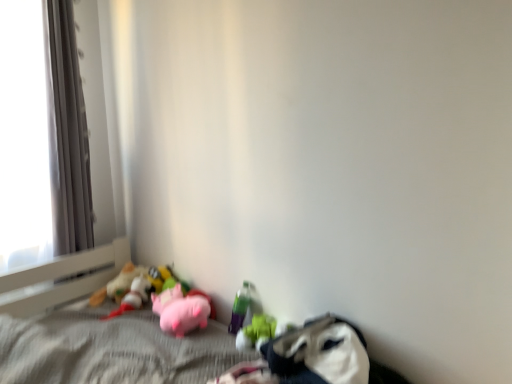
What is the approximate height of pink plush toys at lower left?

pink plush toys at lower left is 26.25 inches in height.

What is the approximate height of rubber duck at lower center, arranged as the 4th toy when viewed from the left?

rubber duck at lower center, arranged as the 4th toy when viewed from the left, is 4.71 inches tall.

What do you see at coordinates (260, 332) in the screenshot? I see `rubber duck at lower center, which ranks as the first toy in right-to-left order` at bounding box center [260, 332].

Image resolution: width=512 pixels, height=384 pixels. What do you see at coordinates (244, 306) in the screenshot? I see `translucent plastic bottle at lower center, placed as the second toy when sorted from right to left` at bounding box center [244, 306].

Describe the element at coordinates (165, 279) in the screenshot. The width and height of the screenshot is (512, 384). I see `pink plush pig at lower center, the third toy when ordered from right to left` at that location.

Identify the location of pink plush pig at center. (155, 295).

Where is `pink plush toys at lower left`? The height and width of the screenshot is (384, 512). pink plush toys at lower left is located at coordinates (110, 349).

Does translucent plastic bottle at lower center, positioned as the third toy in left-to-right order, have a smaller size compared to pink plush toys at lower left?

Yes, translucent plastic bottle at lower center, positioned as the third toy in left-to-right order, is smaller than pink plush toys at lower left.

Considering their positions, is translucent plastic bottle at lower center, positioned as the third toy in left-to-right order, located in front of or behind pink plush toys at lower left?

translucent plastic bottle at lower center, positioned as the third toy in left-to-right order, is positioned farther from the viewer than pink plush toys at lower left.

Identify the location of bed that is on the left side of translucent plastic bottle at lower center, placed as the second toy when sorted from right to left. (110, 349).

Is translucent plastic bottle at lower center, positioned as the third toy in left-to-right order, shorter than pink plush toys at lower left?

Yes, translucent plastic bottle at lower center, positioned as the third toy in left-to-right order, is shorter than pink plush toys at lower left.

From a real-world perspective, is pink plush pig at center located beneath soft plush toys at lower left, marked as the 4th toy in a right-to-left arrangement?

Yes, from a real-world perspective, pink plush pig at center is under soft plush toys at lower left, marked as the 4th toy in a right-to-left arrangement.

How different are the orientations of pink plush pig at center and soft plush toys at lower left, placed as the 1th toy when sorted from left to right, in degrees?

They differ by 1.71e-05 degrees in their facing directions.

Does pink plush pig at center have a greater width compared to soft plush toys at lower left, marked as the 4th toy in a right-to-left arrangement?

No.

From the image's perspective, is pink plush toys at lower left positioned above or below rubber duck at lower center, which ranks as the first toy in right-to-left order?

Clearly, from the image's perspective, pink plush toys at lower left is below rubber duck at lower center, which ranks as the first toy in right-to-left order.

Is pink plush toys at lower left thinner than rubber duck at lower center, which ranks as the first toy in right-to-left order?

In fact, pink plush toys at lower left might be wider than rubber duck at lower center, which ranks as the first toy in right-to-left order.

Between pink plush toys at lower left and rubber duck at lower center, which ranks as the first toy in right-to-left order, which one has less height?

rubber duck at lower center, which ranks as the first toy in right-to-left order, is shorter.

Is pink plush toys at lower left not within rubber duck at lower center, arranged as the 4th toy when viewed from the left?

pink plush toys at lower left is positioned outside rubber duck at lower center, arranged as the 4th toy when viewed from the left.

From the image's perspective, is rubber duck at lower center, which ranks as the first toy in right-to-left order, above pink plush pig at center?

No, from the image's perspective, rubber duck at lower center, which ranks as the first toy in right-to-left order, is not on top of pink plush pig at center.

Considering the sizes of objects rubber duck at lower center, which ranks as the first toy in right-to-left order, and pink plush pig at center in the image provided, who is taller, rubber duck at lower center, which ranks as the first toy in right-to-left order, or pink plush pig at center?

pink plush pig at center.

Choose the correct answer: Is rubber duck at lower center, which ranks as the first toy in right-to-left order, inside pink plush pig at center or outside it?

rubber duck at lower center, which ranks as the first toy in right-to-left order, lies outside pink plush pig at center.

Is rubber duck at lower center, arranged as the 4th toy when viewed from the left, oriented away from soft plush toys at lower left, placed as the 1th toy when sorted from left to right?

That's not correct — rubber duck at lower center, arranged as the 4th toy when viewed from the left, is not looking away from soft plush toys at lower left, placed as the 1th toy when sorted from left to right.

Is rubber duck at lower center, arranged as the 4th toy when viewed from the left, positioned beyond the bounds of soft plush toys at lower left, marked as the 4th toy in a right-to-left arrangement?

Absolutely, rubber duck at lower center, arranged as the 4th toy when viewed from the left, is external to soft plush toys at lower left, marked as the 4th toy in a right-to-left arrangement.

Would you say rubber duck at lower center, arranged as the 4th toy when viewed from the left, is to the left or to the right of soft plush toys at lower left, placed as the 1th toy when sorted from left to right, in the picture?

From the image, it's evident that rubber duck at lower center, arranged as the 4th toy when viewed from the left, is to the right of soft plush toys at lower left, placed as the 1th toy when sorted from left to right.

Is rubber duck at lower center, which ranks as the first toy in right-to-left order, bigger or smaller than soft plush toys at lower left, marked as the 4th toy in a right-to-left arrangement?

rubber duck at lower center, which ranks as the first toy in right-to-left order, is smaller than soft plush toys at lower left, marked as the 4th toy in a right-to-left arrangement.

From the image's perspective, does pink plush pig at center appear higher than pink plush toys at lower left?

Yes, from the image's perspective, pink plush pig at center is on top of pink plush toys at lower left.

Looking at this image, in the image, is pink plush pig at center positioned in front of or behind pink plush toys at lower left?

pink plush pig at center is behind pink plush toys at lower left.

Considering the relative sizes of pink plush pig at center and pink plush toys at lower left in the image provided, is pink plush pig at center wider than pink plush toys at lower left?

In fact, pink plush pig at center might be narrower than pink plush toys at lower left.

In the image, is pink plush pig at center on the left side or the right side of pink plush toys at lower left?

In the image, pink plush pig at center appears on the right side of pink plush toys at lower left.

Locate an element on the screen. This screenshot has width=512, height=384. window frame behind the pink plush pig at center is located at coordinates (54, 158).

In the scene shown: Which object is wider, pink plush pig at center or white plastic window frame at left?

With larger width is pink plush pig at center.

Consider the image. From the image's perspective, which object appears higher, pink plush pig at center or white plastic window frame at left?

white plastic window frame at left, from the image's perspective.

Considering the relative sizes of pink plush pig at center and white plastic window frame at left in the image provided, is pink plush pig at center smaller than white plastic window frame at left?

Yes.

Identify the location of the 2nd toy behind the pink plush toys at lower left, counting from the anchor's position. (244, 306).

The height and width of the screenshot is (384, 512). In order to click on toy that is the 3rd one when counting upward from the pink plush pig at center (from the image's perspective) in this screenshot , I will do `click(119, 284)`.

Based on the photo, when comparing their distances from pink plush pig at lower center, the third toy when ordered from right to left, does soft plush toys at lower left, marked as the 4th toy in a right-to-left arrangement, or rubber duck at lower center, arranged as the 4th toy when viewed from the left, seem further?

rubber duck at lower center, arranged as the 4th toy when viewed from the left, is positioned further to the anchor pink plush pig at lower center, the third toy when ordered from right to left.

Which object lies nearer to the anchor point pink plush toys at lower left, translucent plastic bottle at lower center, positioned as the third toy in left-to-right order, or pink plush pig at center?

pink plush pig at center is positioned closer to the anchor pink plush toys at lower left.

Considering their positions, is rubber duck at lower center, which ranks as the first toy in right-to-left order, positioned closer to pink plush pig at center than translucent plastic bottle at lower center, placed as the second toy when sorted from right to left?

translucent plastic bottle at lower center, placed as the second toy when sorted from right to left.

Which object lies nearer to the anchor point rubber duck at lower center, which ranks as the first toy in right-to-left order, soft plush toys at lower left, marked as the 4th toy in a right-to-left arrangement, or pink plush pig at center?

pink plush pig at center is positioned closer to the anchor rubber duck at lower center, which ranks as the first toy in right-to-left order.

Looking at the image, which one is located further to pink plush toys at lower left, pink plush pig at center or soft plush toys at lower left, marked as the 4th toy in a right-to-left arrangement?

Based on the image, soft plush toys at lower left, marked as the 4th toy in a right-to-left arrangement, appears to be further to pink plush toys at lower left.

Consider the image. Looking at the image, which one is located closer to pink plush pig at center, pink plush pig at lower center, which is the 2th toy in left-to-right order, or soft plush toys at lower left, marked as the 4th toy in a right-to-left arrangement?

Among the two, pink plush pig at lower center, which is the 2th toy in left-to-right order, is located nearer to pink plush pig at center.

Which object lies further to the anchor point white plastic window frame at left, pink plush toys at lower left or pink plush pig at lower center, which is the 2th toy in left-to-right order?

pink plush pig at lower center, which is the 2th toy in left-to-right order, lies further to white plastic window frame at left than the other object.

Consider the image. Based on their spatial positions, is pink plush pig at lower center, the third toy when ordered from right to left, or soft plush toys at lower left, marked as the 4th toy in a right-to-left arrangement, closer to pink plush toys at lower left?

soft plush toys at lower left, marked as the 4th toy in a right-to-left arrangement.

Where is `toy between rubber duck at lower center, arranged as the 4th toy when viewed from the left, and pink plush pig at lower center, which is the 2th toy in left-to-right order, in the front-back direction`? toy between rubber duck at lower center, arranged as the 4th toy when viewed from the left, and pink plush pig at lower center, which is the 2th toy in left-to-right order, in the front-back direction is located at coordinates (244, 306).

At what (x,y) coordinates should I click in order to perform the action: click on stuff located between pink plush pig at lower center, the third toy when ordered from right to left, and rubber duck at lower center, arranged as the 4th toy when viewed from the left, in the left-right direction. Please return your answer as a coordinate pair (x, y). Looking at the image, I should click on (155, 295).

Image resolution: width=512 pixels, height=384 pixels. What are the coordinates of `stuff between white plastic window frame at left and translucent plastic bottle at lower center, positioned as the third toy in left-to-right order, from left to right` in the screenshot? It's located at (155, 295).

Identify the location of stuff between pink plush toys at lower left and soft plush toys at lower left, placed as the 1th toy when sorted from left to right, along the z-axis. This screenshot has height=384, width=512. (155, 295).